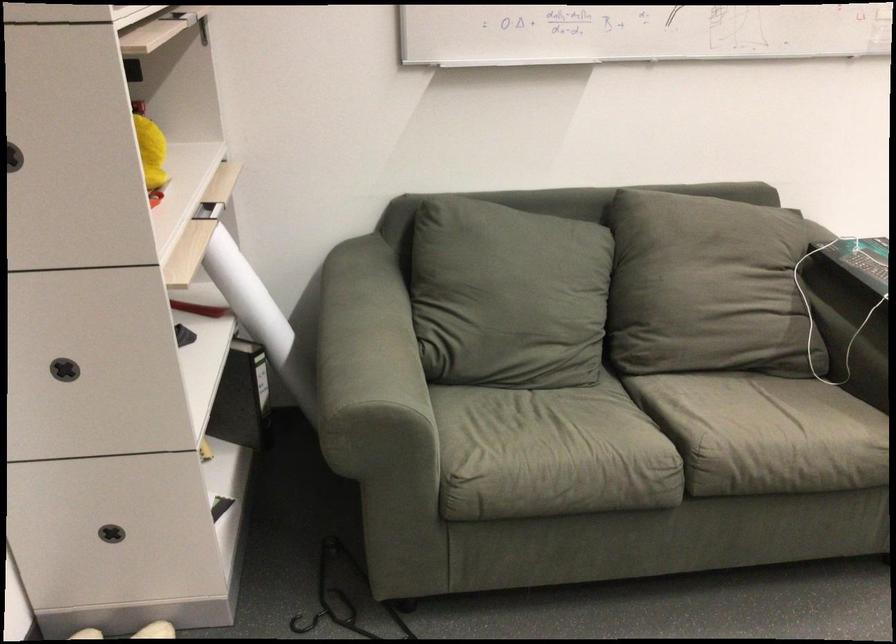
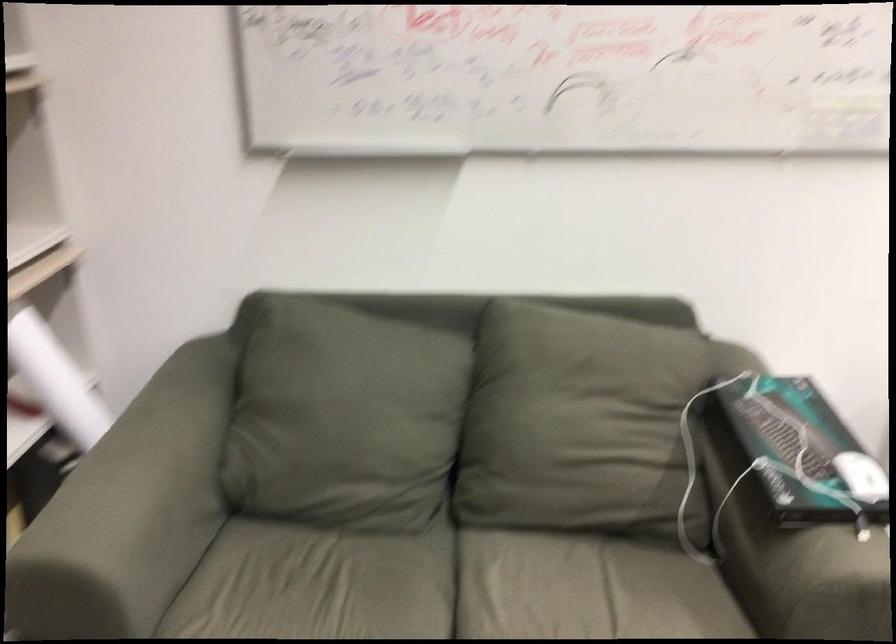
What movement of the cameraman would produce the second image?

The cameraman walked toward right, forward.